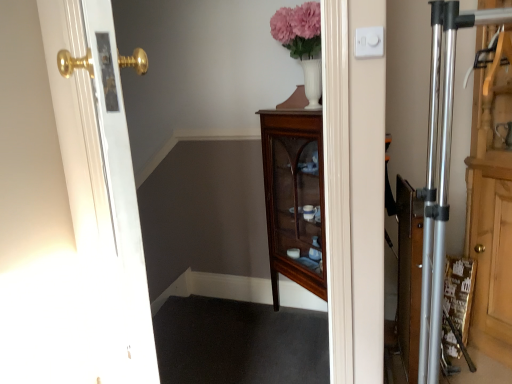
Where is `free space to the left of mahogany glass-front cabinet at center`? This screenshot has height=384, width=512. free space to the left of mahogany glass-front cabinet at center is located at coordinates (221, 336).